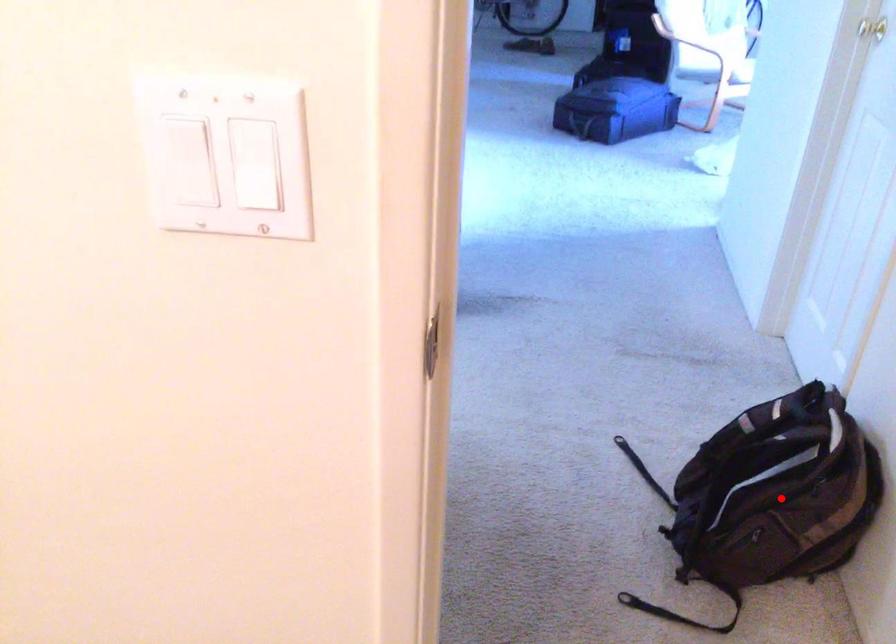
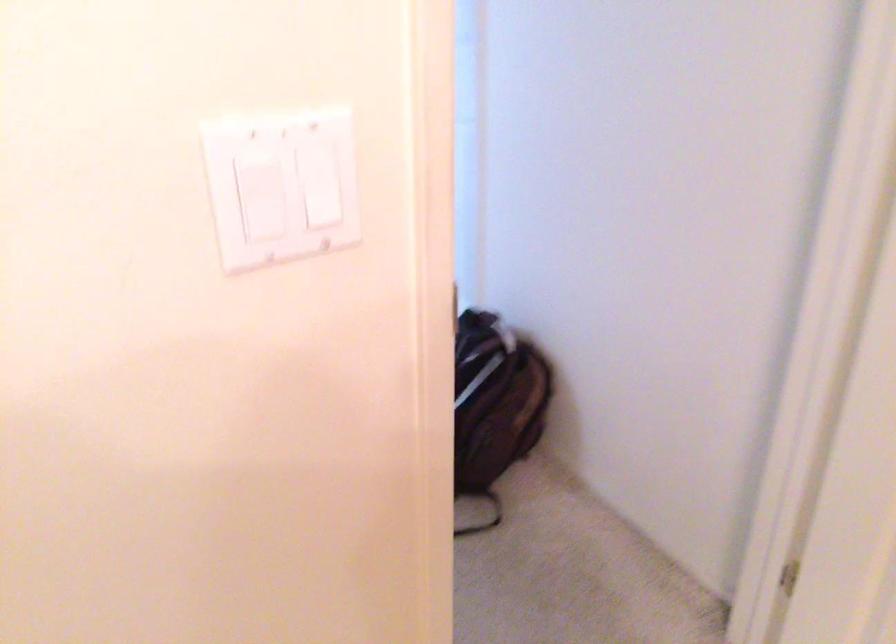
Question: I am providing you with two images of the same scene from different viewpoints. A red point is shown in image1. For the corresponding object point in image2, is it positioned nearer or farther from the camera?

Choices:
 (A) Nearer
 (B) Farther

Answer: (B)